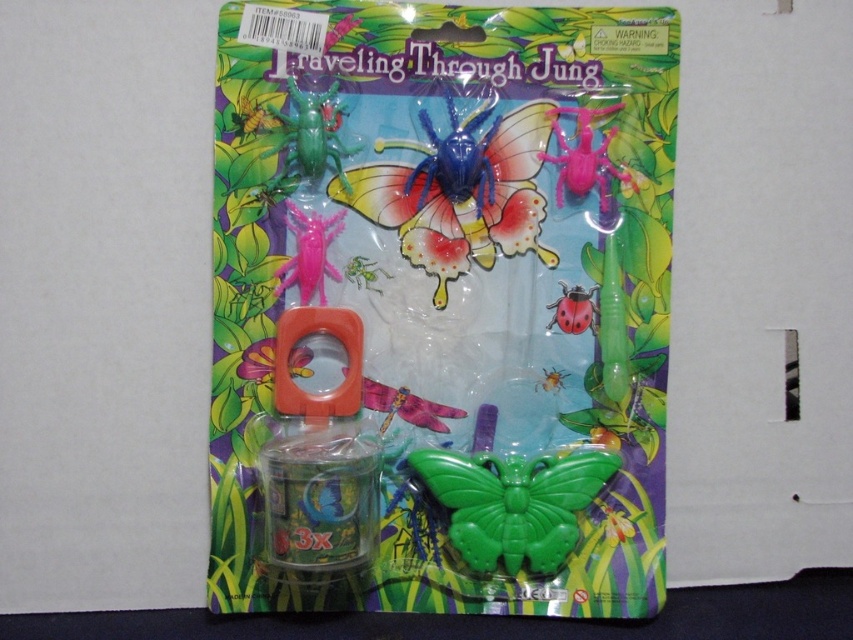
Question: Among these objects, which one is farthest from the camera?

Choices:
 (A) pink plastic spider at upper right
 (B) translucent plastic butterfly at center

Answer: (B)

Question: Is translucent plastic butterfly at center positioned before pink plastic spider at upper right?

Choices:
 (A) no
 (B) yes

Answer: (A)

Question: Where is green matte butterfly at center located in relation to green matte insect at upper center in the image?

Choices:
 (A) right
 (B) left

Answer: (A)

Question: Based on their relative distances, which object is nearer to the pink plastic spider at upper right?

Choices:
 (A) yellow matte butterfly at center
 (B) translucent plastic butterfly at center
 (C) green matte butterfly at center
 (D) green matte insect at upper center

Answer: (B)

Question: Can you confirm if pink plastic spider at upper right is positioned above yellow matte butterfly at center?

Choices:
 (A) no
 (B) yes

Answer: (B)

Question: Which of the following is the closest to the observer?

Choices:
 (A) green matte insect at upper center
 (B) yellow matte butterfly at center
 (C) translucent plastic butterfly at center
 (D) green matte butterfly at center

Answer: (D)